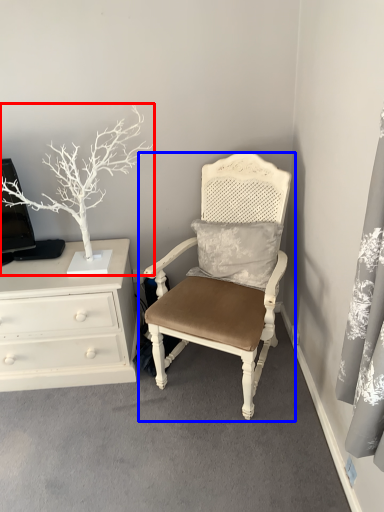
Question: Which of the following is the farthest to the observer, houseplant (highlighted by a red box) or chair (highlighted by a blue box)?

Choices:
 (A) houseplant
 (B) chair

Answer: (A)